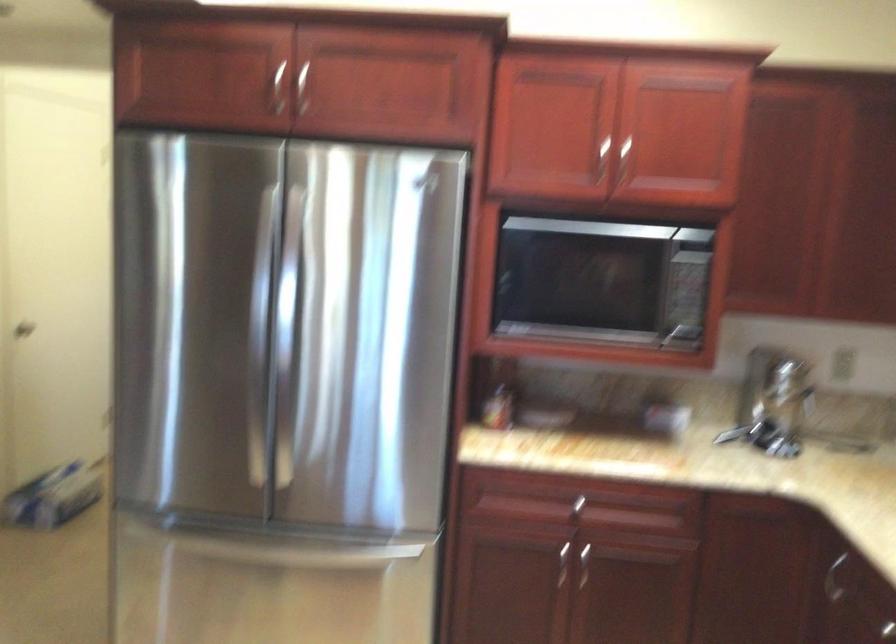
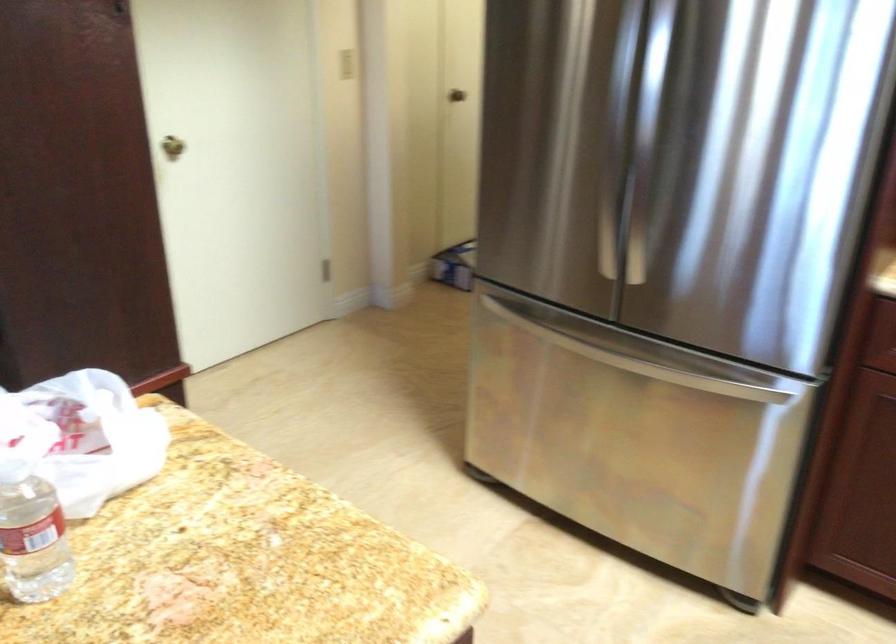
The point at (302, 363) is marked in the first image. Where is the corresponding point in the second image?

(650, 144)